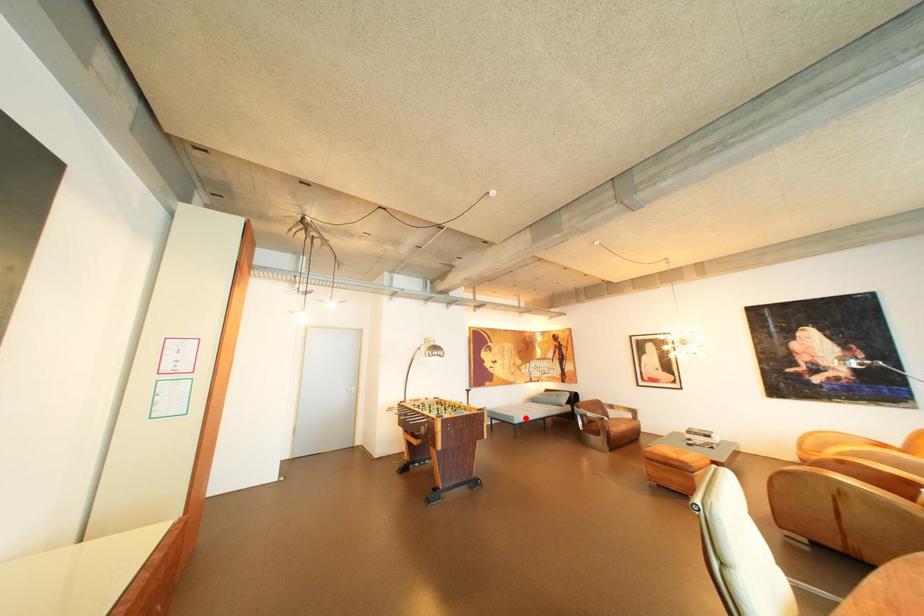
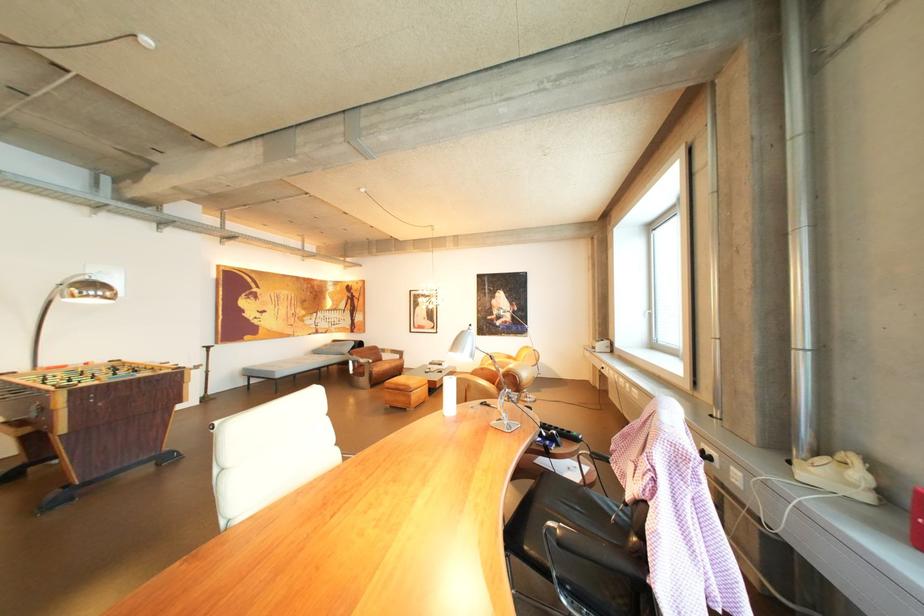
Locate, in the second image, the point that corresponds to the highlighted location in the first image.

(286, 373)